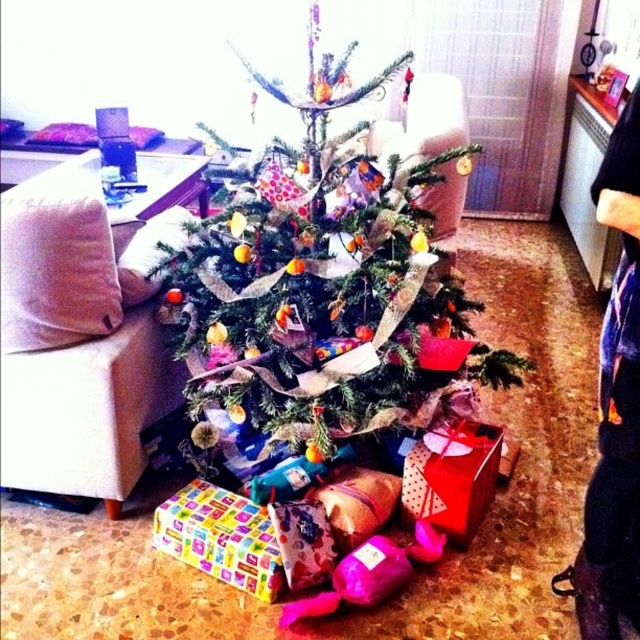
In the scene shown: You are a delivery person who just arrived at the house and need to place a new gift between the multicolored paper wrapped gift at lower center and the shiny red gift at lower center. The gift you are carrying is 12 inches wide. Can you fit it between them without moving the existing gifts?

The distance between the multicolored paper wrapped gift at lower center and the shiny red gift at lower center is 23.80 inches. Since your gift is 12 inches wide, there is enough space to place it between them without moving the existing gifts.

You are a guest in the living room and want to pick up the multicolored paper wrapped gift at lower center and the shiny red gift at lower center. Which gift should you reach for first to get the one closer to you?

The multicolored paper wrapped gift at lower center is closer to the viewer than the shiny red gift at lower center, so you should reach for the multicolored paper wrapped gift at lower center first.

Based on the photo, you are a child who wants to grab the shiny red gift at lower center. You see the dark blue jeans at lower right in the way. Can you reach the gift without moving the jeans?

The dark blue jeans at lower right is much taller than the shiny red gift at lower center, so the jeans might block your view or access to the gift. You might need to move the jeans to reach the gift.